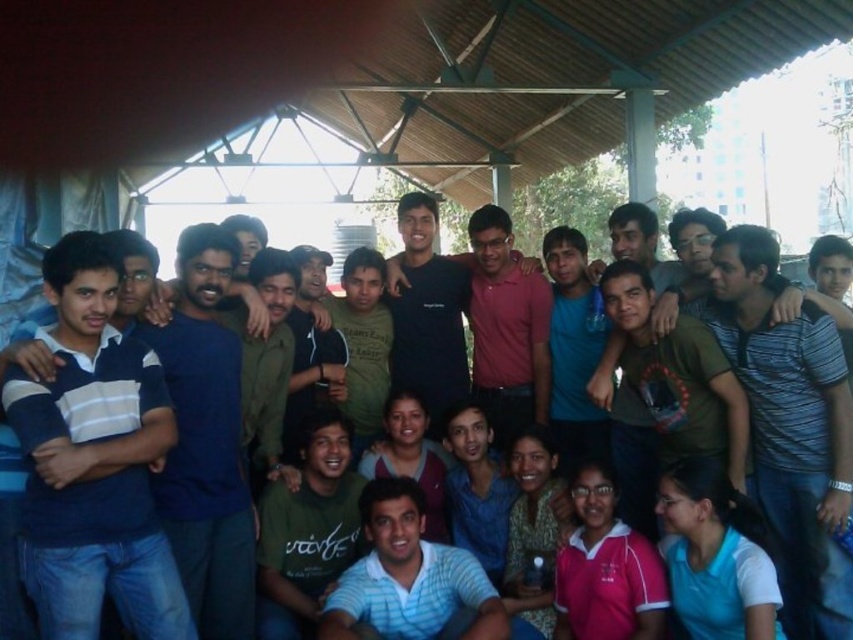
Question: Which of the following is the farthest from the observer?

Choices:
 (A) (543, 397)
 (B) (838, 515)
 (C) (309, 538)
 (D) (387, 618)

Answer: (A)

Question: Among these points, which one is farthest from the camera?

Choices:
 (A) (144, 408)
 (B) (328, 432)

Answer: (B)

Question: Among these points, which one is farthest from the camera?

Choices:
 (A) (279, 557)
 (B) (799, 499)

Answer: (A)

Question: Is green matte shirt at center smaller than blue matte shirt at center?

Choices:
 (A) no
 (B) yes

Answer: (B)

Question: Can you confirm if green matte shirt at center is positioned above black cotton shirt at center?

Choices:
 (A) no
 (B) yes

Answer: (A)

Question: From the image, what is the correct spatial relationship of dark blue t-shirt at center in relation to blue matte shirt at center?

Choices:
 (A) right
 (B) left

Answer: (B)